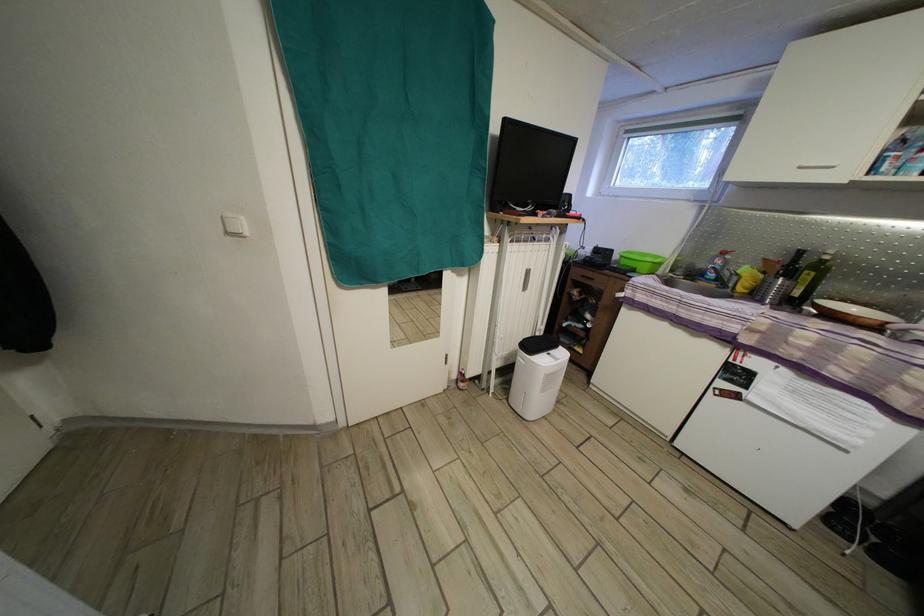
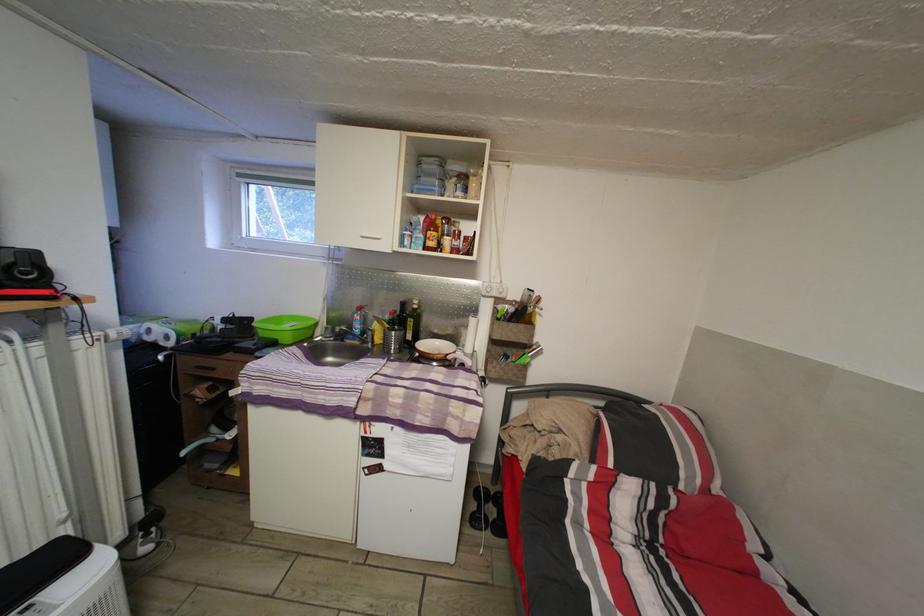
In the second image, find the point that corresponds to [618,257] in the first image.

(257, 326)